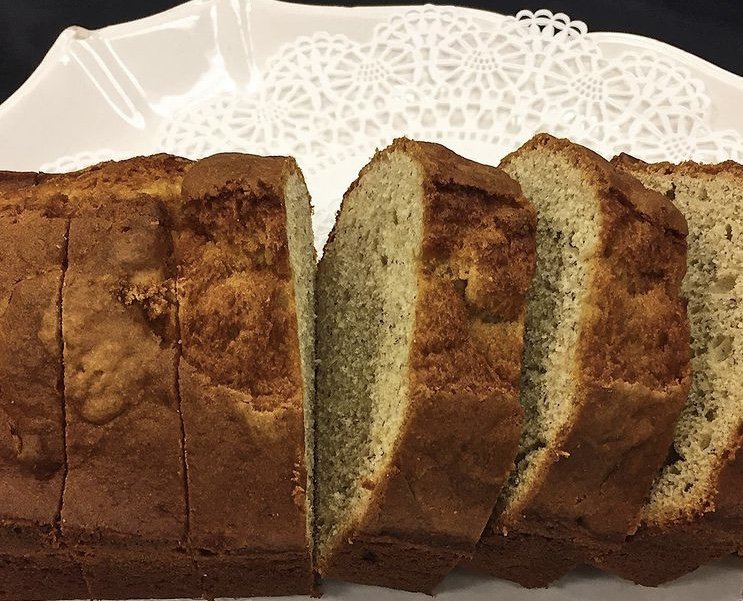
Where is `doilie`? doilie is located at coordinates pos(374,106).